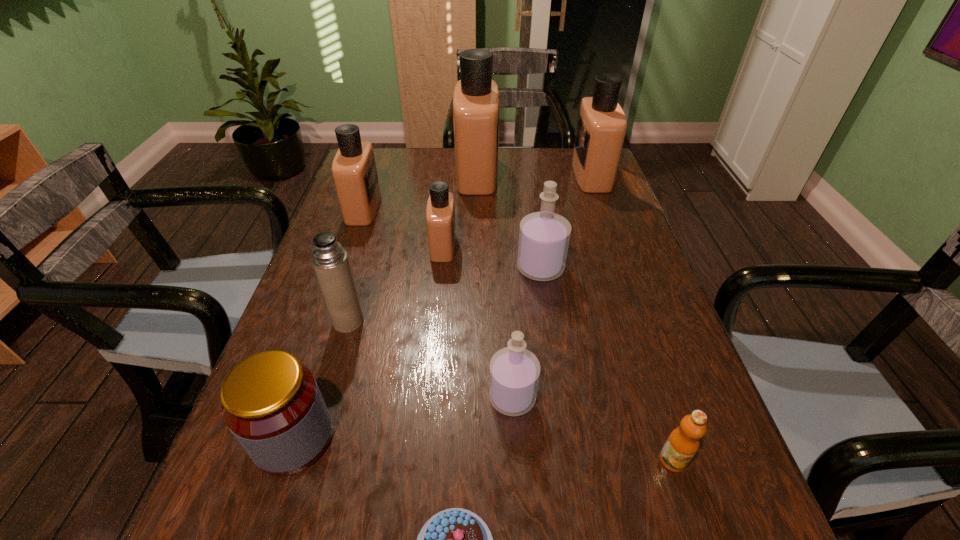
Locate an element on the screen. vacant point that satisfies the following two spatial constraints: 1. on the front label of the second tallest object; 2. on the front side of the farther purple perfume is located at coordinates (625, 268).